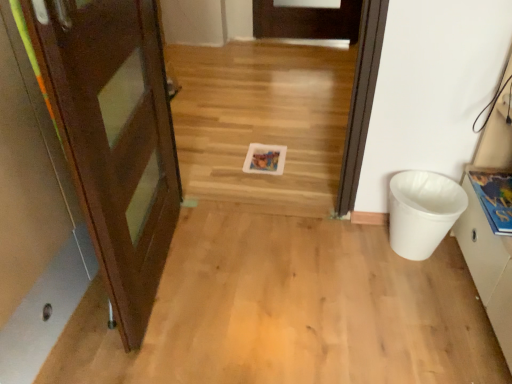
Question: From the image's perspective, does white plastic trash can at right appear lower than white matte cabinet at right?

Choices:
 (A) no
 (B) yes

Answer: (B)

Question: From the image's perspective, does white plastic trash can at right appear higher than white matte cabinet at right?

Choices:
 (A) yes
 (B) no

Answer: (B)

Question: Considering the relative sizes of white plastic trash can at right and white matte cabinet at right in the image provided, is white plastic trash can at right shorter than white matte cabinet at right?

Choices:
 (A) no
 (B) yes

Answer: (B)

Question: Is white plastic trash can at right looking in the opposite direction of white matte cabinet at right?

Choices:
 (A) no
 (B) yes

Answer: (A)

Question: Is white plastic trash can at right to the left of white matte cabinet at right from the viewer's perspective?

Choices:
 (A) yes
 (B) no

Answer: (A)

Question: From the image's perspective, relative to white matte cabinet at right, is white plastic trash can at right above or below?

Choices:
 (A) above
 (B) below

Answer: (B)

Question: Is white plastic trash can at right inside or outside of white matte cabinet at right?

Choices:
 (A) outside
 (B) inside

Answer: (A)

Question: Relative to white matte cabinet at right, is white plastic trash can at right in front or behind?

Choices:
 (A) behind
 (B) front

Answer: (A)

Question: Is white plastic trash can at right taller or shorter than white matte cabinet at right?

Choices:
 (A) tall
 (B) short

Answer: (B)

Question: From the image's perspective, is white matte cabinet at right positioned above or below white plastic trash can at right?

Choices:
 (A) above
 (B) below

Answer: (A)

Question: From their relative heights in the image, would you say white matte cabinet at right is taller or shorter than white plastic trash can at right?

Choices:
 (A) short
 (B) tall

Answer: (B)

Question: Relative to white plastic trash can at right, is white matte cabinet at right in front or behind?

Choices:
 (A) front
 (B) behind

Answer: (A)

Question: Considering the positions of white matte cabinet at right and white plastic trash can at right in the image, is white matte cabinet at right bigger or smaller than white plastic trash can at right?

Choices:
 (A) big
 (B) small

Answer: (A)

Question: From their relative heights in the image, would you say matte brown door at left is taller or shorter than white matte cabinet at right?

Choices:
 (A) short
 (B) tall

Answer: (B)

Question: Is matte brown door at left inside the boundaries of white matte cabinet at right, or outside?

Choices:
 (A) inside
 (B) outside

Answer: (B)